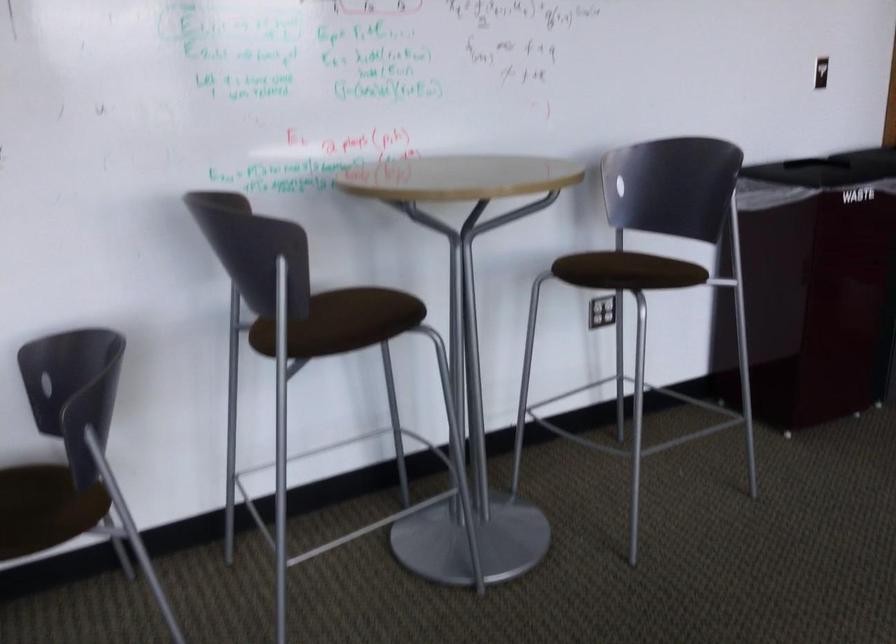
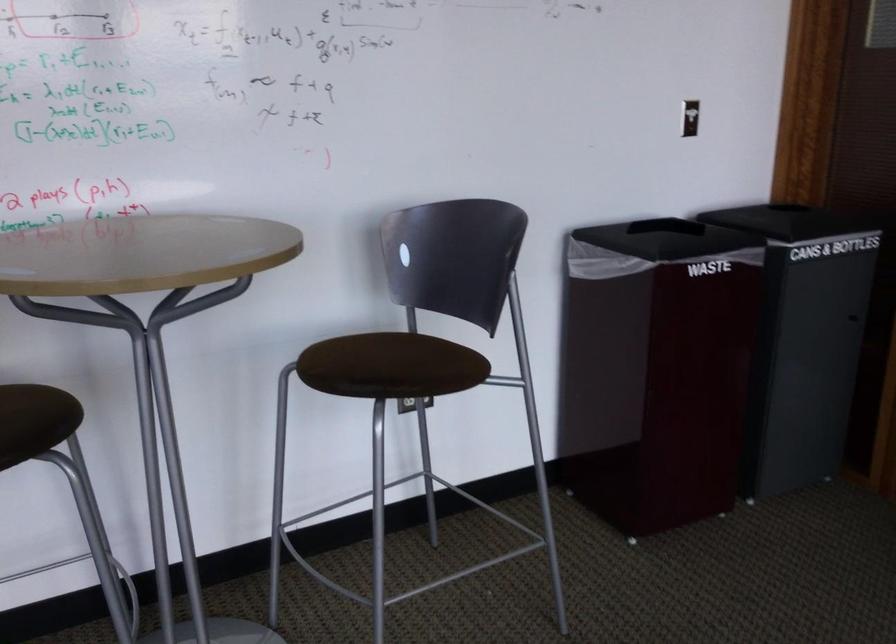
Question: The images are taken continuously from a first-person perspective. In which direction is your viewpoint rotating?

Choices:
 (A) Left
 (B) Right
 (C) Up
 (D) Down

Answer: (B)